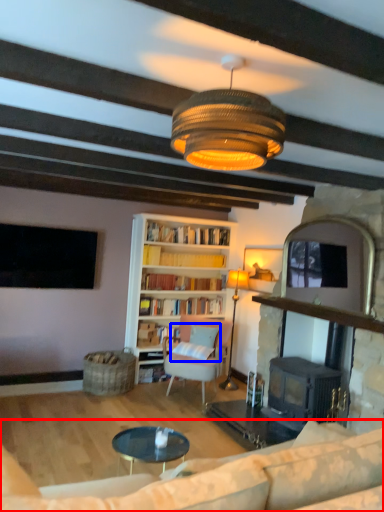
Question: Which point is further to the camera, studio couch (highlighted by a red box) or pillow (highlighted by a blue box)?

Choices:
 (A) studio couch
 (B) pillow

Answer: (B)